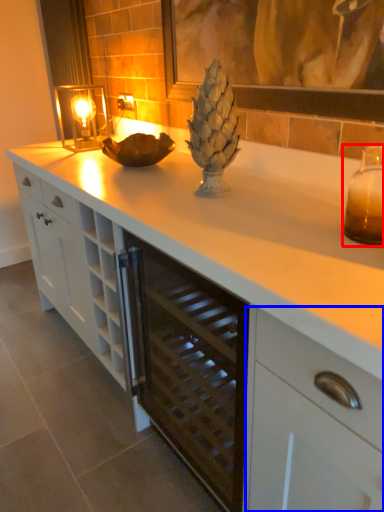
Question: Which point is further to the camera, candle holder (highlighted by a red box) or cabinetry (highlighted by a blue box)?

Choices:
 (A) candle holder
 (B) cabinetry

Answer: (A)